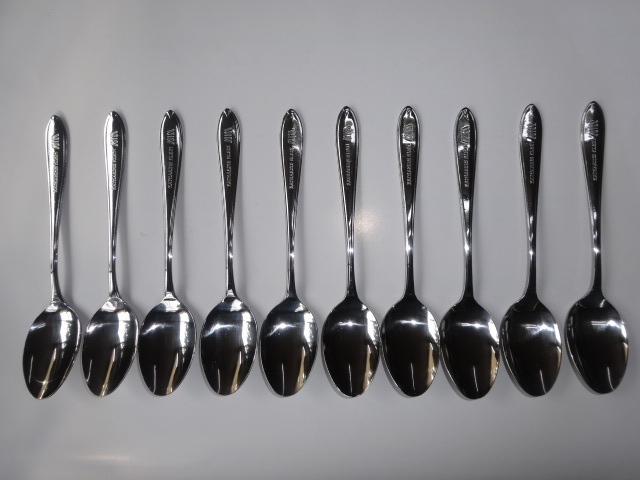
Where is `spoons`? The image size is (640, 480). spoons is located at coordinates (52, 346), (114, 348), (155, 341), (228, 345), (299, 350), (349, 347), (420, 346), (483, 345), (534, 345), (605, 338).